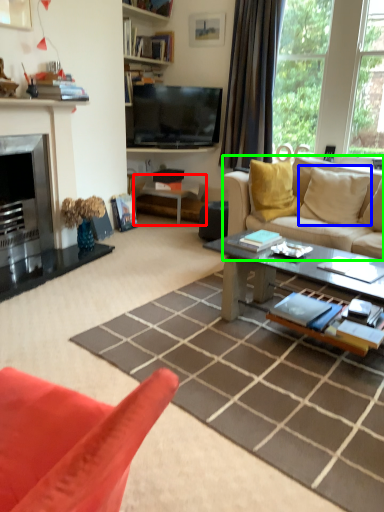
Question: Estimate the real-world distances between objects in this image. Which object is closer to side table (highlighted by a red box), pillow (highlighted by a blue box) or studio couch (highlighted by a green box)?

Choices:
 (A) pillow
 (B) studio couch

Answer: (B)